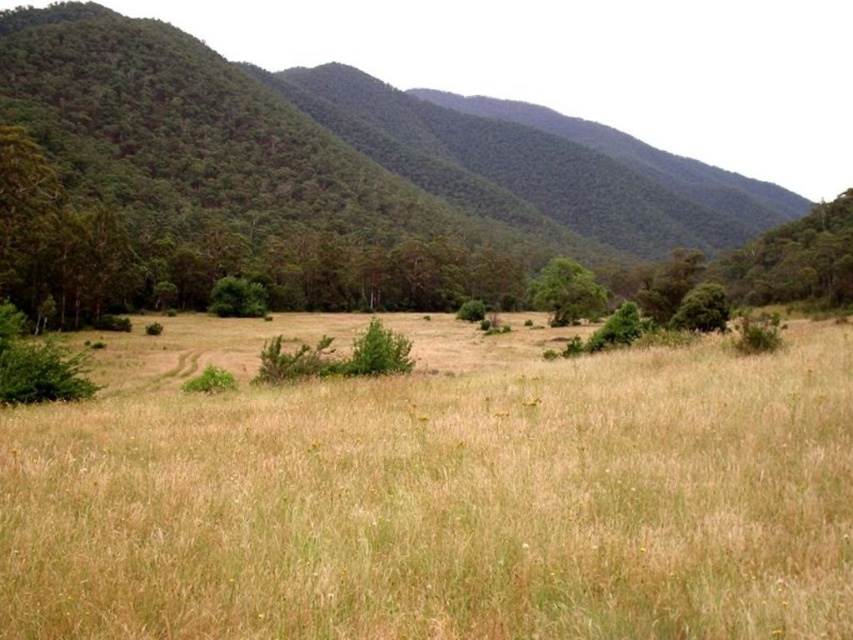
You are standing in the middle of the dry grass at center and looking towards the green forested mountain at center. Which direction should you walk to get closer to the mountain?

The dry grass at center is positioned under the green forested mountain at center, so you should walk forward to get closer to the mountain.

You are standing in the middle of the dry grass at center and looking towards the green leafy tree at center. Which object is taller?

The green leafy tree at center is taller than the dry grass at center.